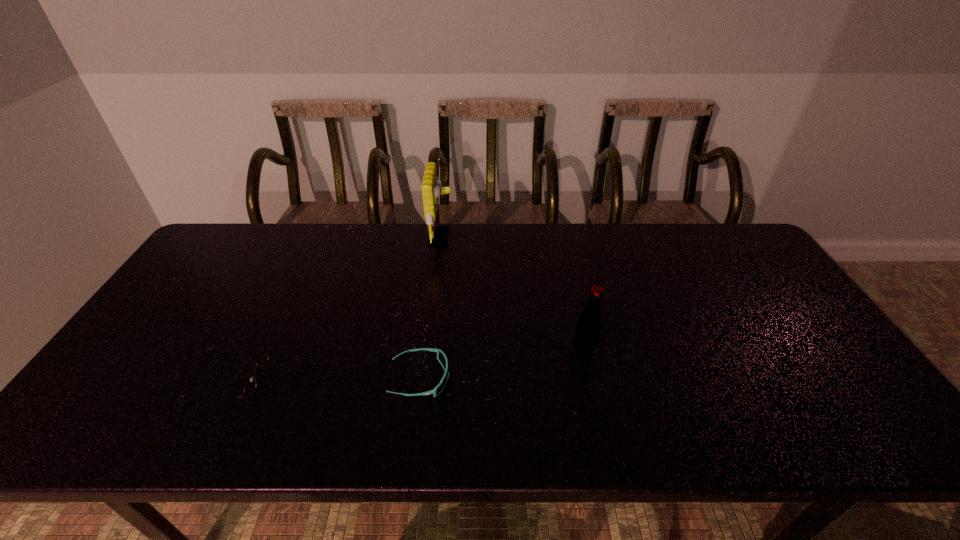
Where is `blank space at the far edge of the desktop`? This screenshot has height=540, width=960. blank space at the far edge of the desktop is located at coordinates (255, 254).

Identify the location of free space at the near edge of the desktop. (310, 415).

Where is `free spot at the left edge of the desktop`? free spot at the left edge of the desktop is located at coordinates (209, 275).

This screenshot has height=540, width=960. I want to click on free space at the far left corner of the desktop, so click(x=230, y=257).

Find the location of a particular element. Image resolution: width=960 pixels, height=540 pixels. free space between the right sunglasses and the sponge is located at coordinates (431, 308).

Identify the location of blank region between the right sunglasses and the sponge. (431, 308).

The height and width of the screenshot is (540, 960). I want to click on vacant space in between the rightmost object and the left sunglasses, so 406,365.

You are a GUI agent. You are given a task and a screenshot of the screen. Output one action in this format:
    pyautogui.click(x=<x>, y=<y>)
    Task: Click on the free spot between the right sunglasses and the farthest object
    This screenshot has width=960, height=540.
    Given the screenshot: What is the action you would take?
    pyautogui.click(x=431, y=308)

Image resolution: width=960 pixels, height=540 pixels. What are the coordinates of `free space between the rightmost object and the leftmost object` in the screenshot? It's located at (406, 365).

The width and height of the screenshot is (960, 540). In order to click on empty space that is in between the right sunglasses and the farthest object in this screenshot , I will do `click(431, 308)`.